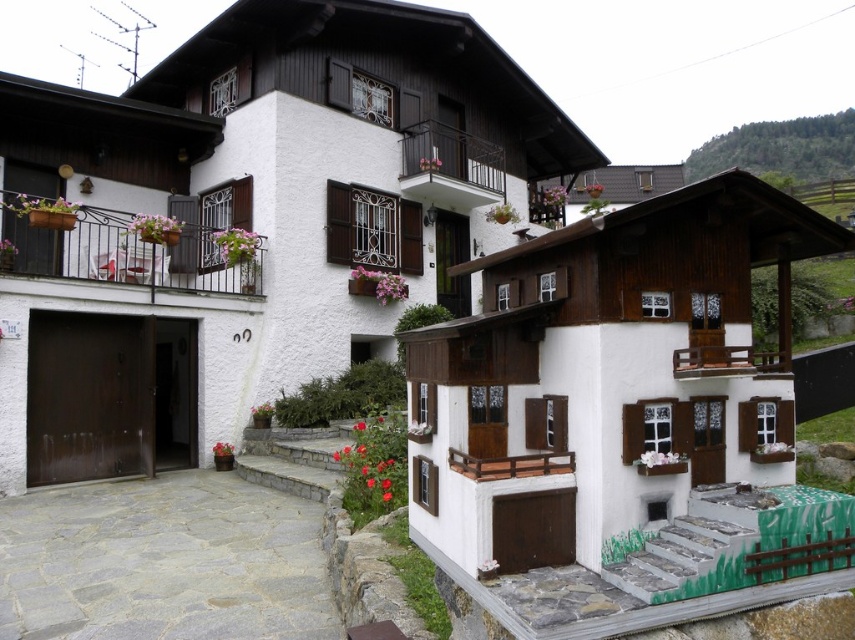
In the scene shown: You are a painter standing at the front of the house and want to paint both the wooden balcony at left and the wooden balcony at center. Which balcony should you look upwards to paint?

The wooden balcony at left is taller than the wooden balcony at center, so you should look upwards to paint the wooden balcony at left.

You are standing in front of the house and want to take a photo of both the wooden balcony at left and the wooden balcony at center. Which balcony should you position yourself closer to in order to capture both in the frame without any obstruction?

You should position yourself closer to the wooden balcony at left because it is in front of the wooden balcony at center, so capturing them both would require focusing on the closer one to avoid obstruction.

You are planning to place a large potted plant on the wooden balcony at upper right and the wooden at center. Based on their sizes, which location can accommodate the plant better?

The wooden balcony at upper right can accommodate the large potted plant better because it is larger in size than the wooden at center.